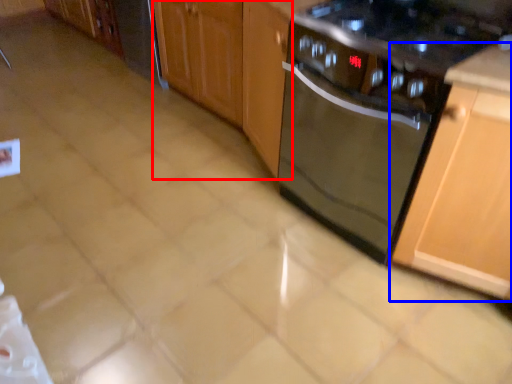
Question: Which object appears closest to the camera in this image, cabinetry (highlighted by a red box) or cabinetry (highlighted by a blue box)?

Choices:
 (A) cabinetry
 (B) cabinetry

Answer: (B)